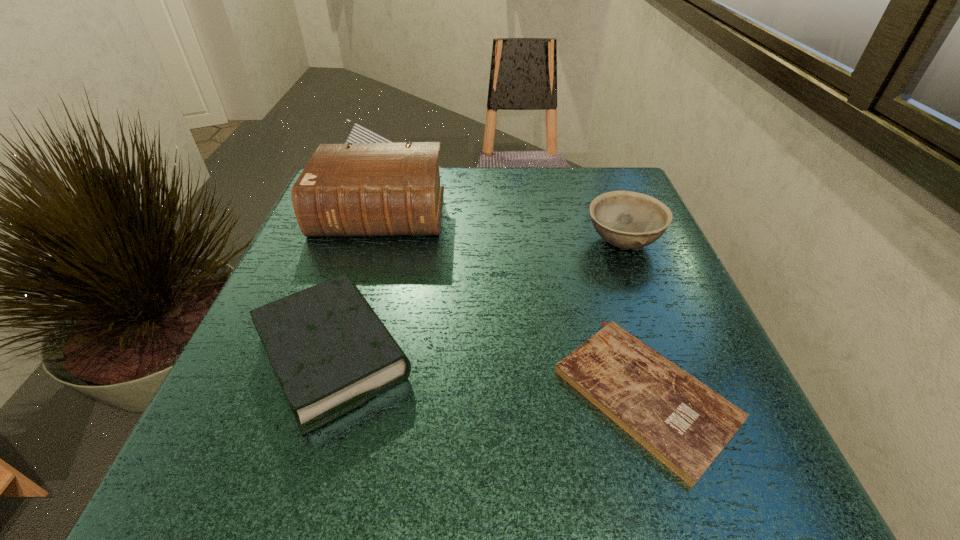
You are a GUI agent. You are given a task and a screenshot of the screen. Output one action in this format:
    pyautogui.click(x=<x>, y=<y>)
    Task: Click on the vacant region at the far right corner
    This screenshot has width=960, height=540.
    Given the screenshot: What is the action you would take?
    pyautogui.click(x=627, y=190)

Where is `free space that is in between the second shortest object and the farthest Bible`? The width and height of the screenshot is (960, 540). free space that is in between the second shortest object and the farthest Bible is located at coordinates (357, 285).

At what (x,y) coordinates should I click in order to perform the action: click on blank region between the shortest Bible and the tallest Bible. Please return your answer as a coordinate pair (x, y). Looking at the image, I should click on (513, 303).

Locate an element on the screen. free point between the tallest Bible and the shortest Bible is located at coordinates (513, 303).

Find the location of a particular element. free spot between the shortest object and the tallest Bible is located at coordinates (513, 303).

Find the location of a particular element. free space that is in between the rightmost Bible and the tallest object is located at coordinates pyautogui.click(x=513, y=303).

I want to click on empty location between the third shortest object and the tallest Bible, so 501,227.

Identify the location of free space between the second shortest object and the bowl. This screenshot has width=960, height=540. (478, 299).

The width and height of the screenshot is (960, 540). I want to click on vacant area that lies between the tallest Bible and the second tallest object, so click(x=501, y=227).

The width and height of the screenshot is (960, 540). What are the coordinates of `vacant space in between the third shortest object and the second shortest Bible` in the screenshot? It's located at (478, 299).